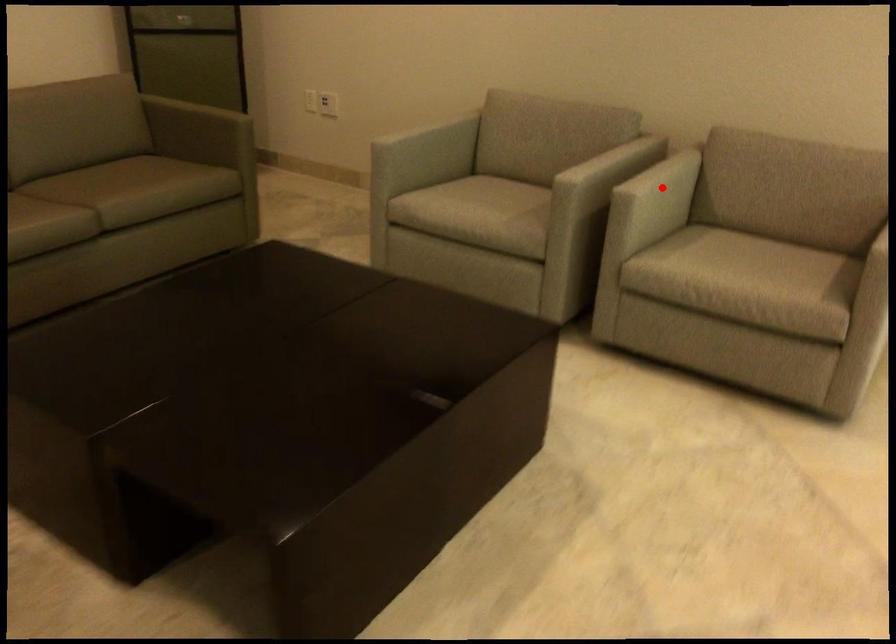
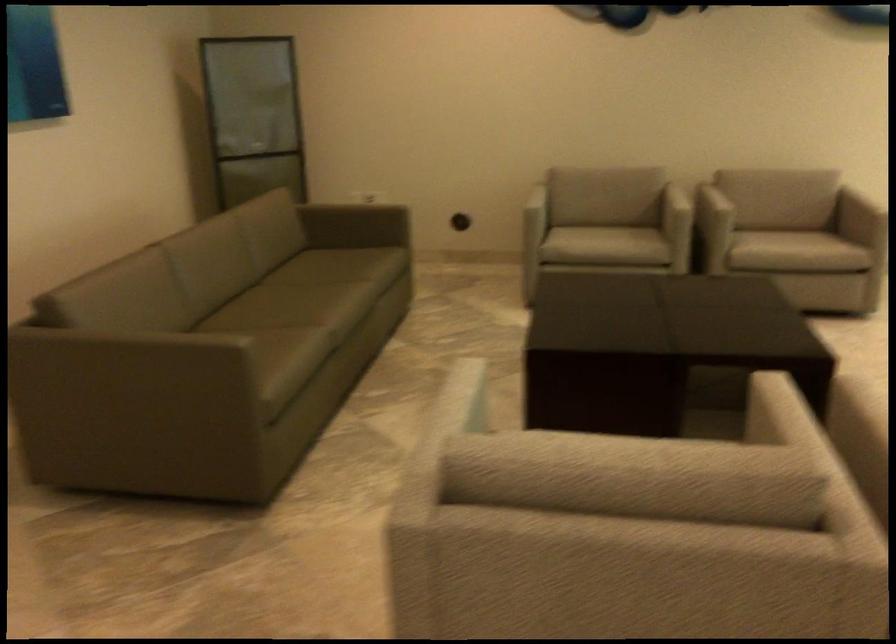
Find the pixel in the second image that matches the highlighted location in the first image.

(709, 201)